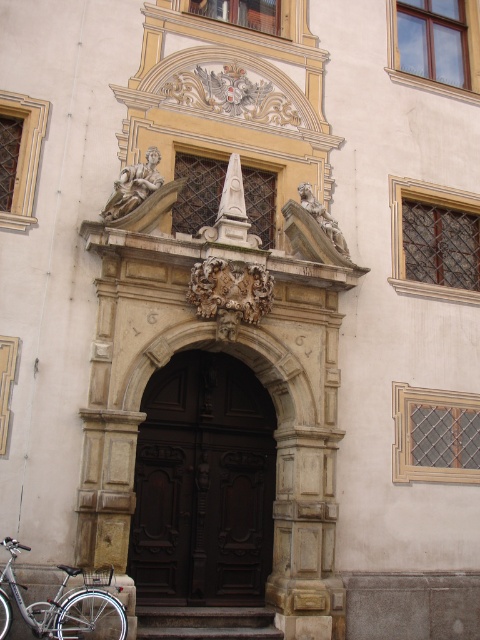
You are standing at the entrance of the building and need to locate the dark wood door at center. According to the coordinates provided, where exactly is the dark wood door positioned?

The dark wood door at center is located at point coordinates of (203, 484).

You are a delivery person trying to park your silver metallic bicycle at lower left near the brown wooden stairs at center. Considering their widths, can the bicycle fit alongside the stairs without overlapping?

The silver metallic bicycle at lower left has a lesser width compared to brown wooden stairs at center, so yes, the bicycle can fit alongside the stairs without overlapping since it is narrower.

You are a delivery person who needs to bring a package to the building. The silver metallic bicycle at lower left is blocking the dark wood door at center. Can you enter through the door without moving the bicycle?

The dark wood door at center is shorter than the silver metallic bicycle at lower left, so the bicycle is taller. Since the bicycle is blocking the door and it is taller, you cannot enter through the dark wood door at center without moving the silver metallic bicycle at lower left.